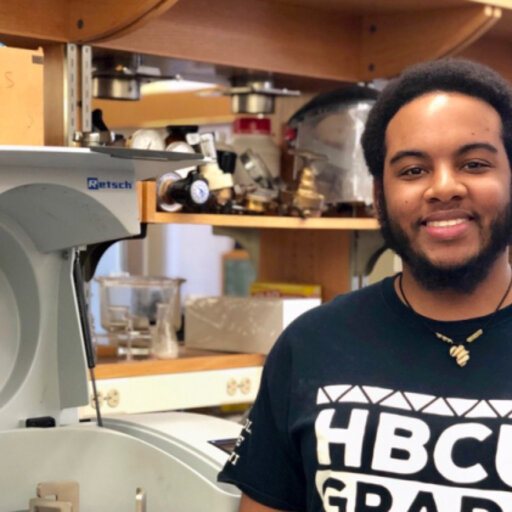
Find the location of a particular element. This screenshot has height=512, width=512. cylindrical metal fixture is located at coordinates (122, 87), (262, 101).